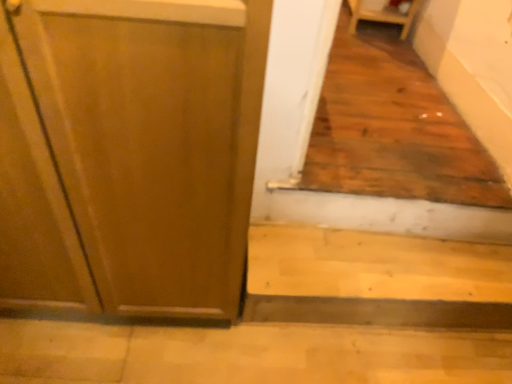
Identify the location of light wood stair at lower right. (375, 279).

Image resolution: width=512 pixels, height=384 pixels. Describe the element at coordinates (375, 279) in the screenshot. I see `light wood stair at lower right` at that location.

Image resolution: width=512 pixels, height=384 pixels. Identify the location of light wood stair at lower right. (375, 279).